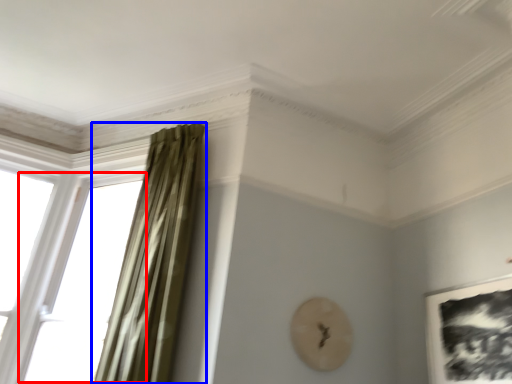
Question: Which object is closer to the camera taking this photo, window (highlighted by a red box) or curtain (highlighted by a blue box)?

Choices:
 (A) window
 (B) curtain

Answer: (B)